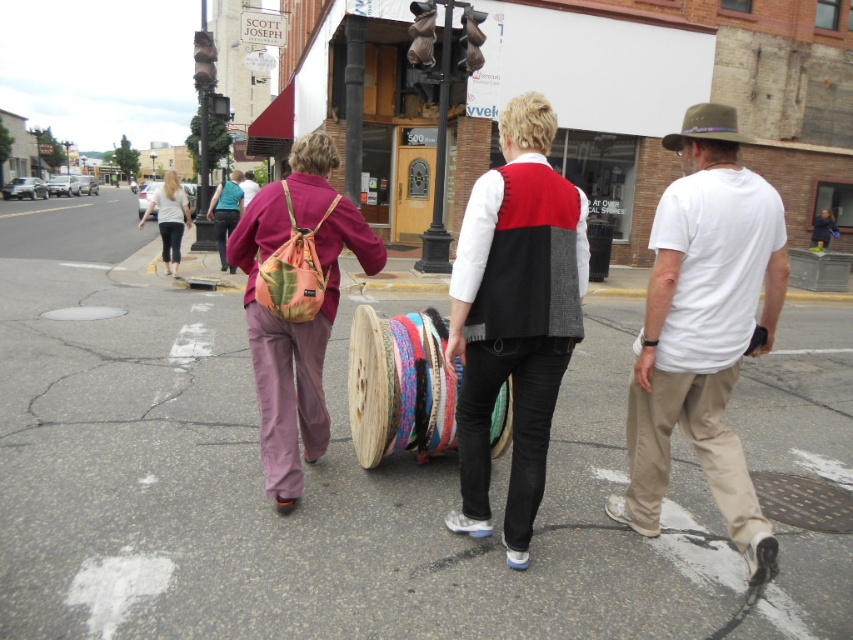
You are a photographer trying to capture a group photo of the red and black sweater vest at center and the light beige cotton shirt at upper left. Which person should you focus on first to ensure they are in the frame?

The red and black sweater vest at center occupies less space than the light beige cotton shirt at upper left, so you should focus on the light beige cotton shirt at upper left first to ensure it is fully captured in the frame.